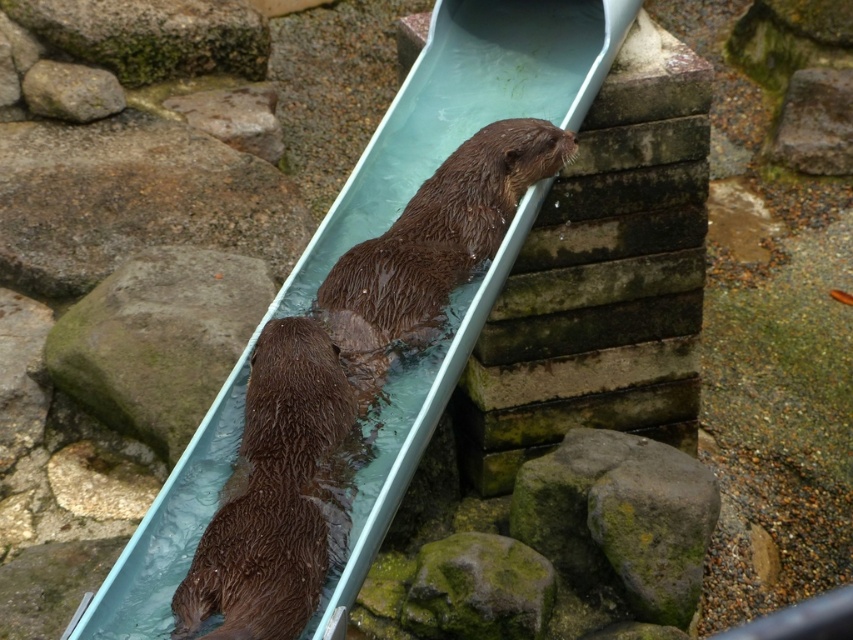
You are a zookeeper observing the otters and their enclosure. You need to ensure the otters can comfortably navigate around the green mossy rock at lower left and the wet brown fur otter at center. Based on their sizes, which object is taller and requires more vertical space?

The green mossy rock at lower left is taller than the wet brown fur otter at center, so it requires more vertical space.

You are an otter trainer observing the slide in the enclosure. You notice two points marked on the slide where otters are sliding. Which of the two points, point (202, 538) or point (161, 300), is closer to you?

Point (202, 538) is closer to the camera than point (161, 300).

You are a zookeeper observing the otters and need to place a feeding tray near the slide. The feeding tray must be positioned so that it is between the wet brown fur otter at center and the green mossy rock at lower left. Where should you place the feeding tray?

The feeding tray should be placed between the wet brown fur otter at center and the green mossy rock at lower left, closer to the otter since it is nearer to the viewer than the rock.